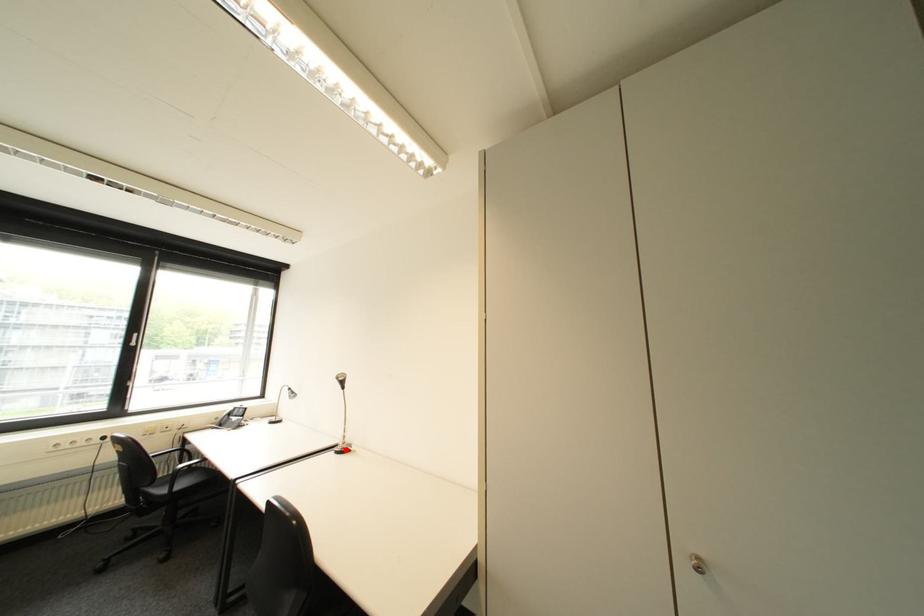
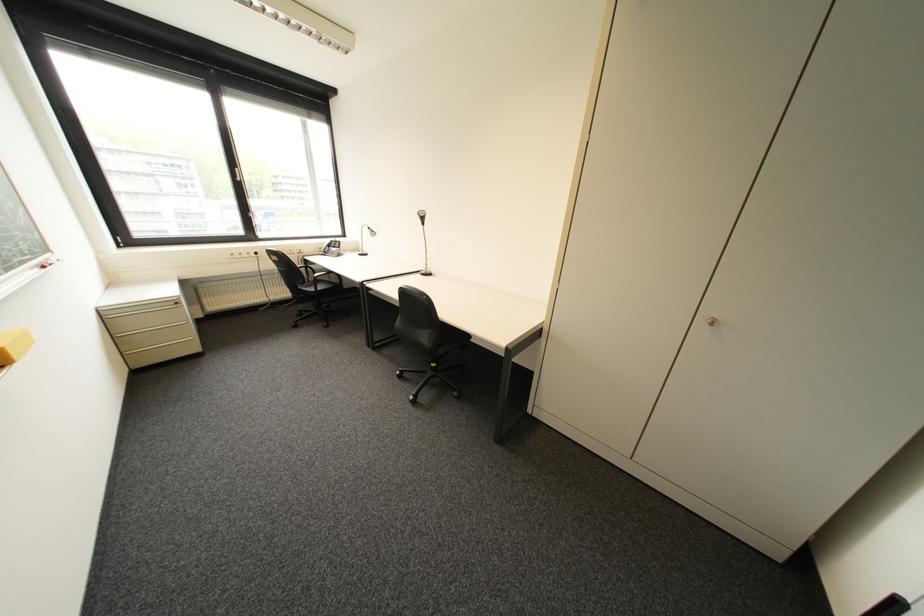
Question: I am providing you with two images of the same scene from different viewpoints. A red point is shown in image1. For the corresponding object point in image2, is it positioned nearer or farther from the camera?

Choices:
 (A) Nearer
 (B) Farther

Answer: (A)